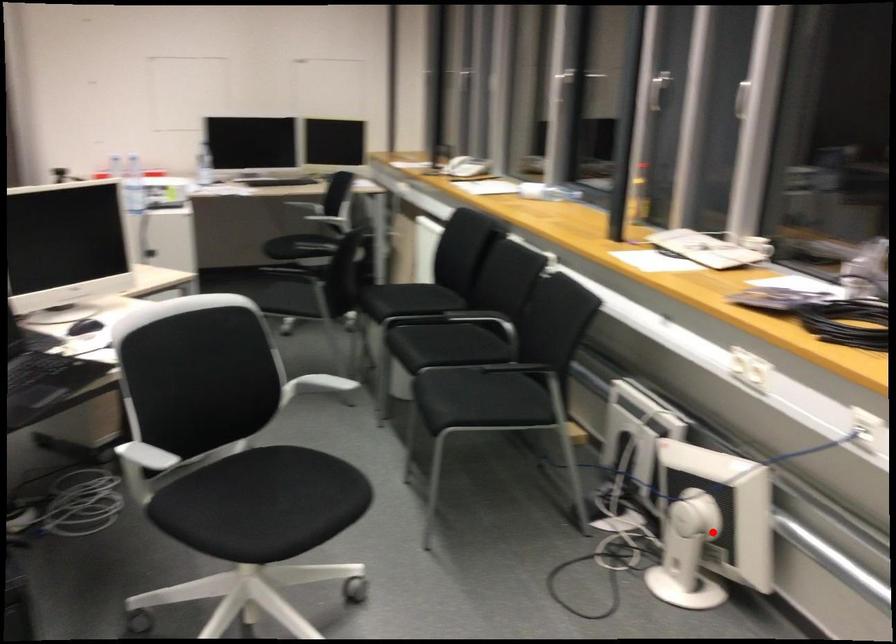
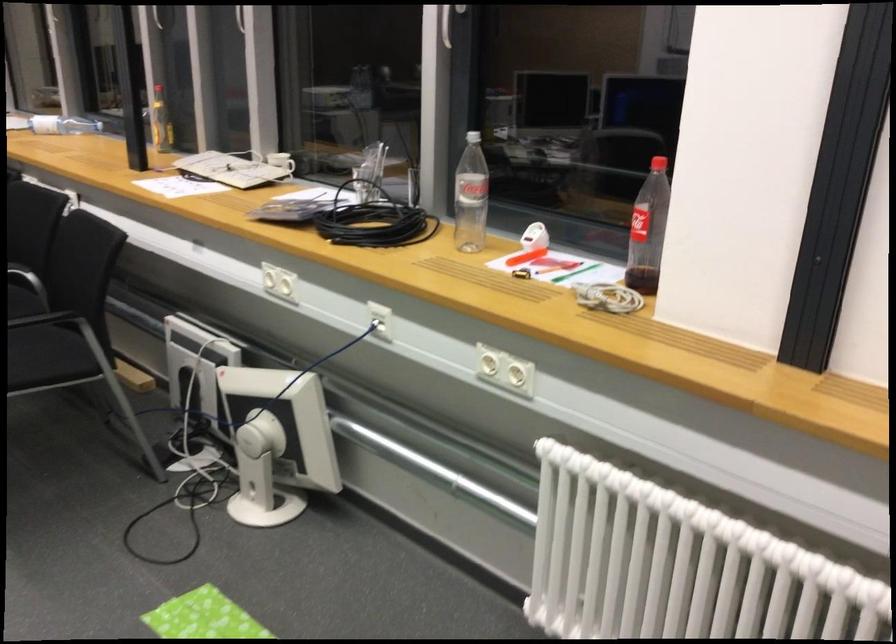
Where in the second image is the point corresponding to the highlighted location from the first image?

(277, 442)